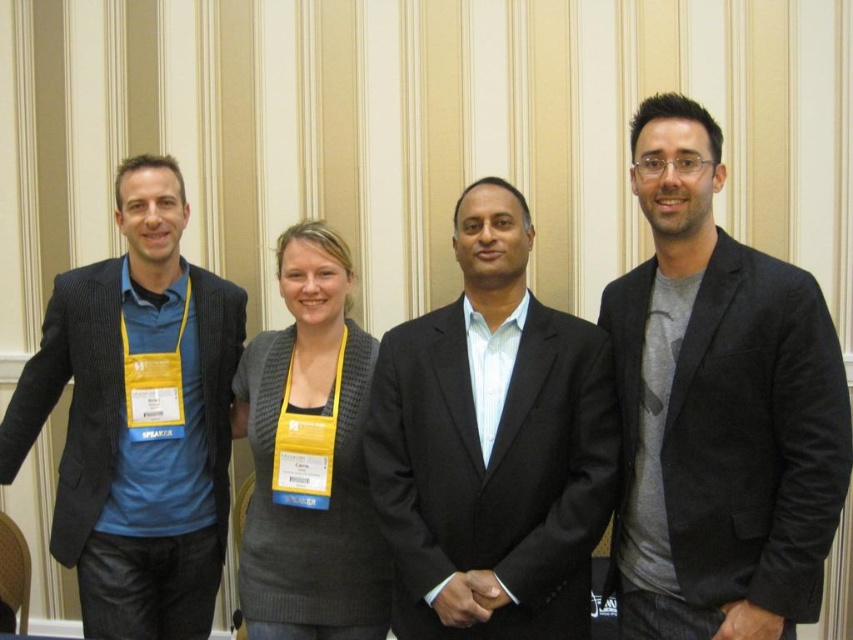
You are standing in front of the group of four people in the image. There are two points marked in the scene. The first point is at coordinates point (393, 541) and the second point is at point (218, 490). Which of these two points is closer to you?

Point (393, 541) is closer to the viewer than point (218, 490).

You are standing at the origin point in the image. Where is the matte black suit at center located in terms of coordinates?

The matte black suit at center is located at coordinates point (491, 445).

Looking at the scene with the dark gray cotton blazer at right and the matte black blazer at left, which blazer is positioned to the right side of the other?

The dark gray cotton blazer at right is positioned to the right of the matte black blazer at left.